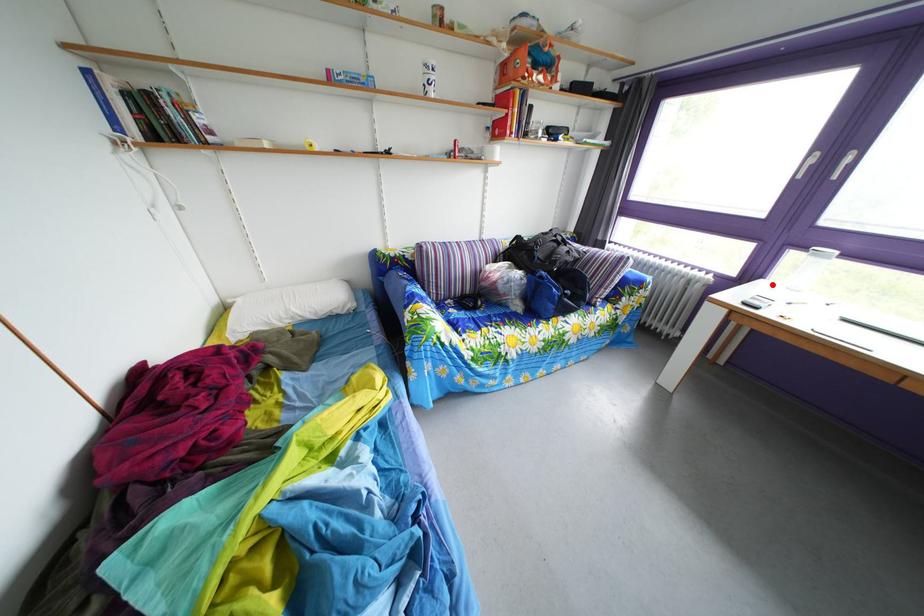
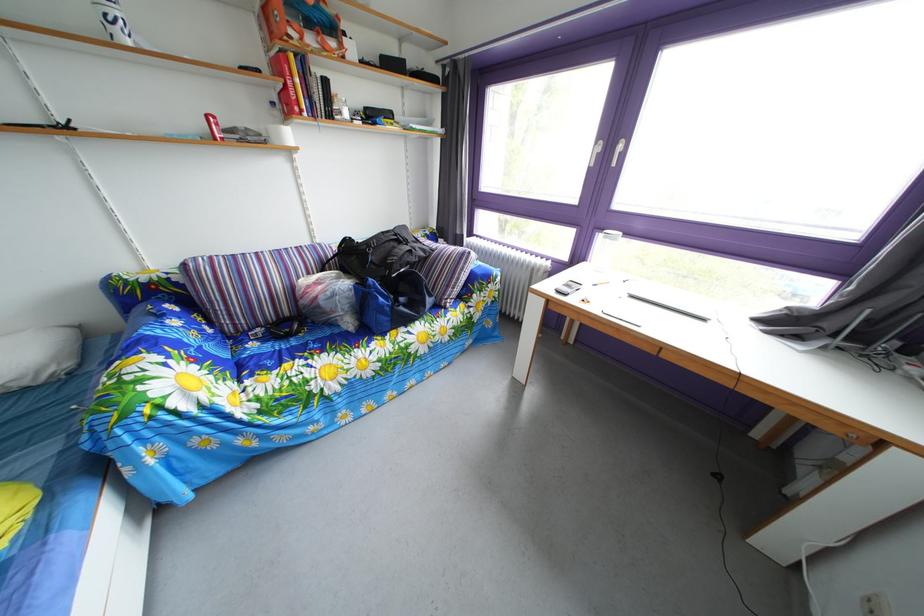
Locate, in the second image, the point that corresponds to the highlighted location in the first image.

(594, 268)